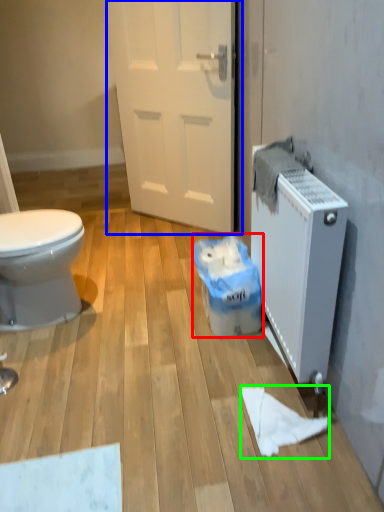
Question: Considering the real-world distances, which object is closest to garbage (highlighted by a red box)? door (highlighted by a blue box) or toilet paper (highlighted by a green box).

Choices:
 (A) door
 (B) toilet paper

Answer: (B)